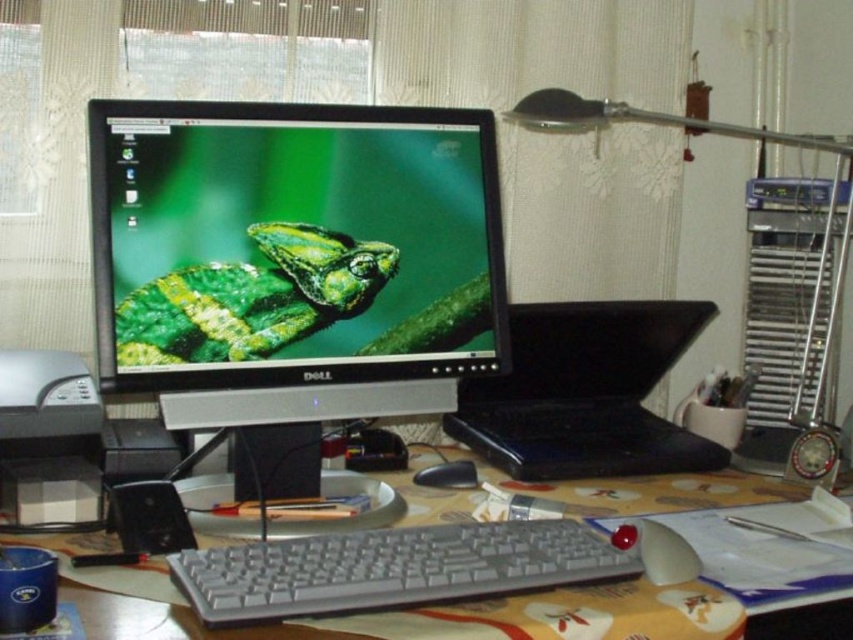
Is the position of green matte chameleon at center less distant than that of black rubber mouse at center?

Yes, green matte chameleon at center is in front of black rubber mouse at center.

Can you confirm if green matte chameleon at center is shorter than black rubber mouse at center?

In fact, green matte chameleon at center may be taller than black rubber mouse at center.

Where is `green matte chameleon at center`? This screenshot has width=853, height=640. green matte chameleon at center is located at coordinates (252, 298).

Describe the element at coordinates (601, 612) in the screenshot. I see `matte plastic computer desk at center` at that location.

Who is lower down, matte plastic computer desk at center or gray plastic keyboard at center?

matte plastic computer desk at center is lower down.

At what (x,y) coordinates should I click in order to perform the action: click on matte plastic computer desk at center. Please return your answer as a coordinate pair (x, y). Looking at the image, I should click on (601, 612).

In order to click on matte plastic computer desk at center in this screenshot , I will do [601, 612].

Is matte black monitor at center thinner than black plastic laptop at center?

In fact, matte black monitor at center might be wider than black plastic laptop at center.

Can you confirm if matte black monitor at center is shorter than black plastic laptop at center?

In fact, matte black monitor at center may be taller than black plastic laptop at center.

Which is behind, point (318, 163) or point (579, 403)?

The point (579, 403) is more distant.

Locate an element on the screen. Image resolution: width=853 pixels, height=640 pixels. matte black monitor at center is located at coordinates (294, 257).